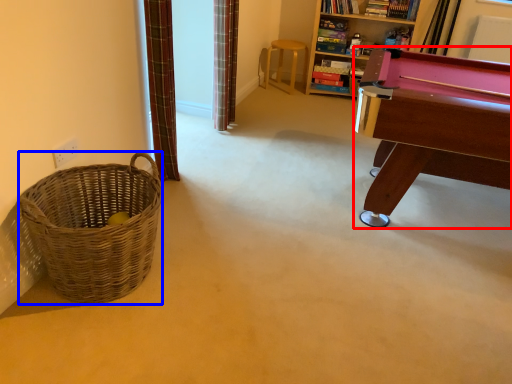
Question: Which of the following is the closest to the observer, table (highlighted by a red box) or basket (highlighted by a blue box)?

Choices:
 (A) table
 (B) basket

Answer: (B)